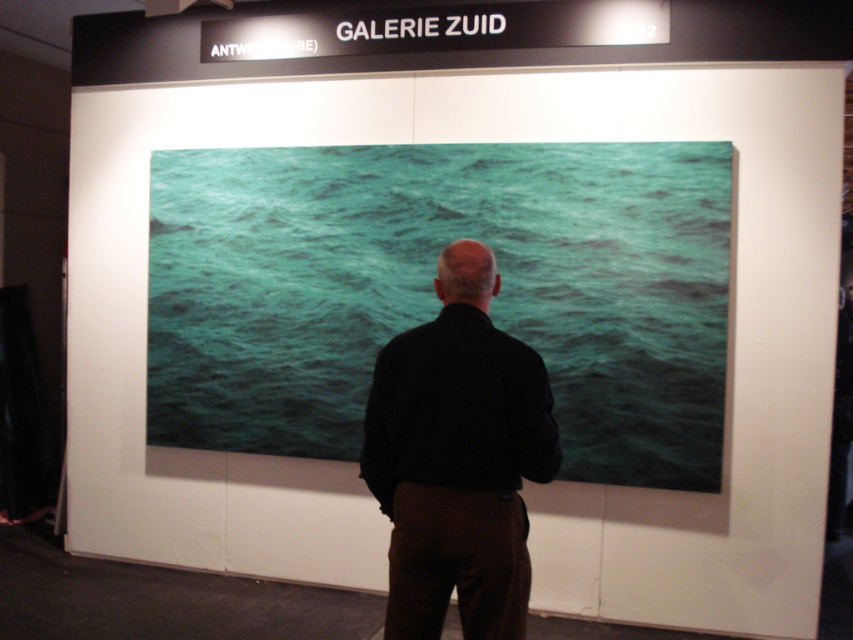
Is point (262, 230) positioned before point (479, 285)?

That is False.

Is teal glossy water at center in front of black matte shirt at center?

No, teal glossy water at center is further to the viewer.

Image resolution: width=853 pixels, height=640 pixels. Describe the element at coordinates (433, 296) in the screenshot. I see `teal glossy water at center` at that location.

Find the location of `teal glossy water at center`. teal glossy water at center is located at coordinates 433,296.